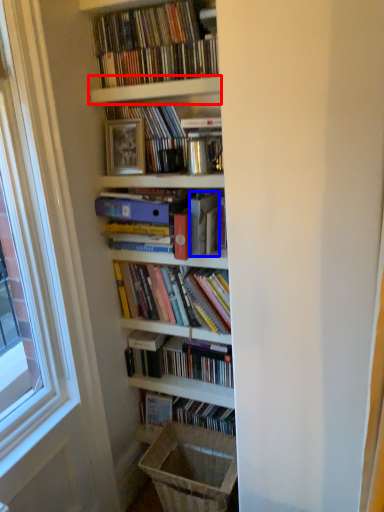
Question: Which point is closer to the camera, shelf (highlighted by a red box) or paperback book (highlighted by a blue box)?

Choices:
 (A) shelf
 (B) paperback book

Answer: (A)